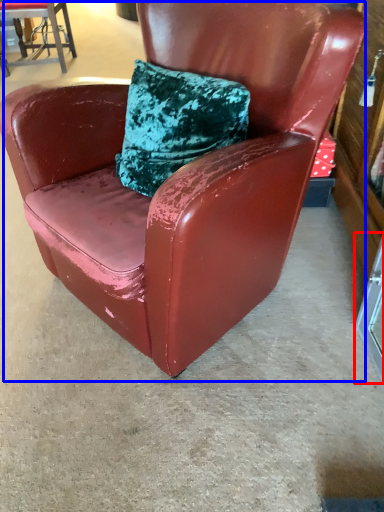
Question: Which object appears closest to the camera in this image, glass door (highlighted by a red box) or chair (highlighted by a blue box)?

Choices:
 (A) glass door
 (B) chair

Answer: (B)